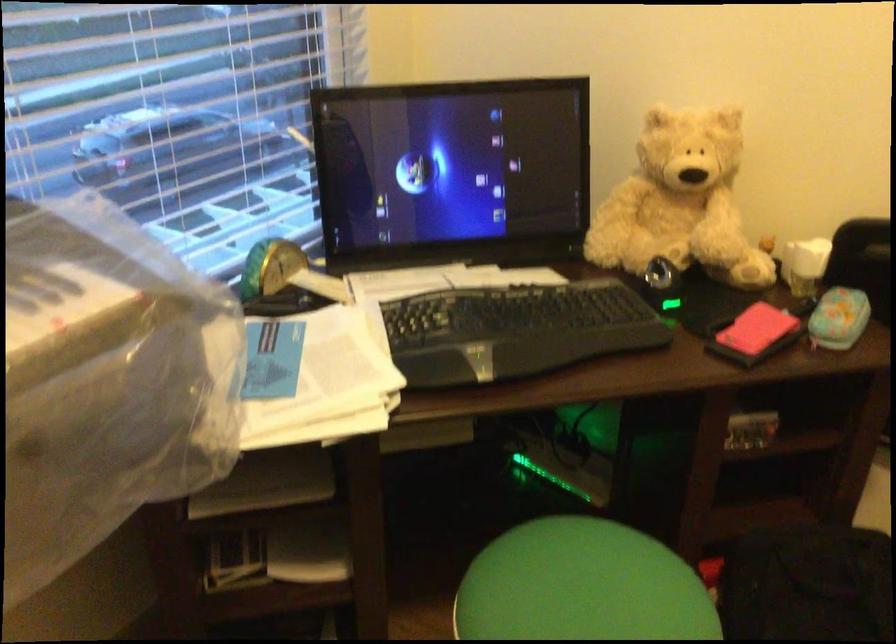
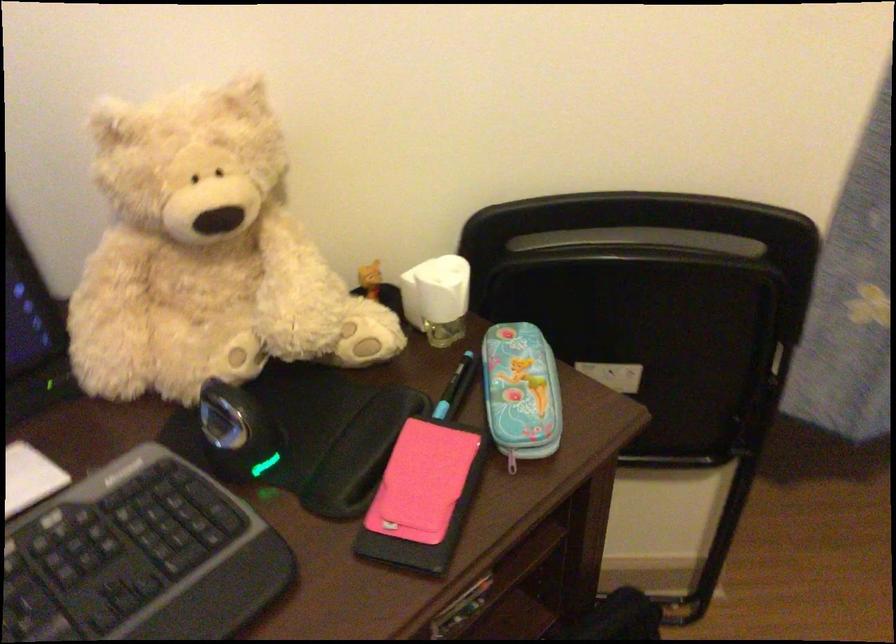
The point at (814, 342) is marked in the first image. Where is the corresponding point in the second image?

(512, 460)